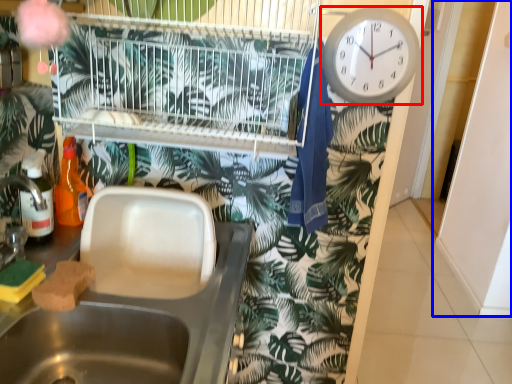
Question: Which of the following is the farthest to the observer, wall clock (highlighted by a red box) or screen door (highlighted by a blue box)?

Choices:
 (A) wall clock
 (B) screen door

Answer: (B)